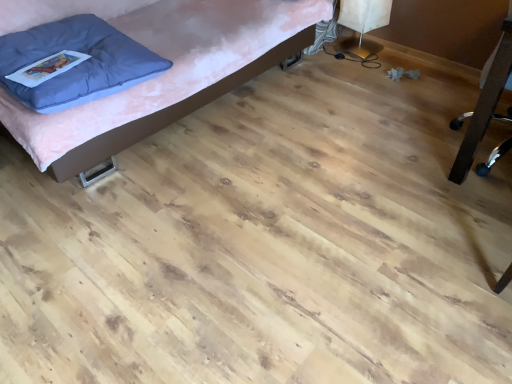
Question: Is matte pink bed at upper left, which ranks as the 1th furniture in left-to-right order, surrounding black plastic chair at right, which ranks as the first furniture in right-to-left order?

Choices:
 (A) no
 (B) yes

Answer: (A)

Question: Considering the relative sizes of matte pink bed at upper left, which ranks as the 1th furniture in left-to-right order, and black plastic chair at right, the 2th furniture viewed from the left, in the image provided, is matte pink bed at upper left, which ranks as the 1th furniture in left-to-right order, bigger than black plastic chair at right, the 2th furniture viewed from the left,?

Choices:
 (A) yes
 (B) no

Answer: (A)

Question: From the image's perspective, is matte pink bed at upper left, which is the second furniture in right-to-left order, beneath black plastic chair at right, the 2th furniture viewed from the left?

Choices:
 (A) yes
 (B) no

Answer: (B)

Question: Does matte pink bed at upper left, which ranks as the 1th furniture in left-to-right order, appear on the right side of black plastic chair at right, the 2th furniture viewed from the left?

Choices:
 (A) no
 (B) yes

Answer: (A)

Question: Are matte pink bed at upper left, which ranks as the 1th furniture in left-to-right order, and black plastic chair at right, which ranks as the first furniture in right-to-left order, far apart?

Choices:
 (A) no
 (B) yes

Answer: (B)

Question: Is matte pink bed at upper left, which is the second furniture in right-to-left order, further to camera compared to black plastic chair at right, the 2th furniture viewed from the left?

Choices:
 (A) yes
 (B) no

Answer: (A)

Question: Considering the relative positions of black plastic chair at right, which ranks as the first furniture in right-to-left order, and matte pink bed at upper left, which ranks as the 1th furniture in left-to-right order, in the image provided, is black plastic chair at right, which ranks as the first furniture in right-to-left order, in front of matte pink bed at upper left, which ranks as the 1th furniture in left-to-right order,?

Choices:
 (A) yes
 (B) no

Answer: (A)

Question: Does black plastic chair at right, the 2th furniture viewed from the left, have a lesser width compared to matte pink bed at upper left, which is the second furniture in right-to-left order?

Choices:
 (A) no
 (B) yes

Answer: (B)

Question: Is black plastic chair at right, the 2th furniture viewed from the left, oriented away from matte pink bed at upper left, which ranks as the 1th furniture in left-to-right order?

Choices:
 (A) yes
 (B) no

Answer: (B)

Question: Could you tell me if black plastic chair at right, the 2th furniture viewed from the left, is facing matte pink bed at upper left, which is the second furniture in right-to-left order?

Choices:
 (A) no
 (B) yes

Answer: (A)

Question: From a real-world perspective, is black plastic chair at right, the 2th furniture viewed from the left, physically above matte pink bed at upper left, which is the second furniture in right-to-left order?

Choices:
 (A) yes
 (B) no

Answer: (A)

Question: Considering the relative sizes of black plastic chair at right, the 2th furniture viewed from the left, and matte pink bed at upper left, which ranks as the 1th furniture in left-to-right order, in the image provided, is black plastic chair at right, the 2th furniture viewed from the left, smaller than matte pink bed at upper left, which ranks as the 1th furniture in left-to-right order,?

Choices:
 (A) yes
 (B) no

Answer: (A)

Question: From the image's perspective, does blue soft pillow at upper left appear higher than matte pink bed at upper left, which is the second furniture in right-to-left order?

Choices:
 (A) no
 (B) yes

Answer: (A)